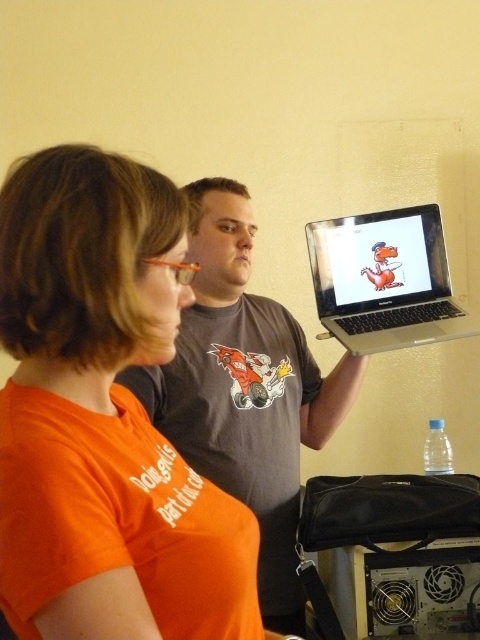
Can you confirm if orange matte shirt at upper left is positioned to the right of gray matte shirt at center?

No, orange matte shirt at upper left is not to the right of gray matte shirt at center.

Based on the photo, does orange matte shirt at upper left appear on the left side of gray matte shirt at center?

Indeed, orange matte shirt at upper left is positioned on the left side of gray matte shirt at center.

Who is more distant from viewer, (78,289) or (279,310)?

The point (279,310) is more distant.

Identify the location of orange matte shirt at upper left. (99, 404).

Who is higher up, orange matte shirt at upper left or silver metallic laptop at upper right?

Positioned higher is silver metallic laptop at upper right.

Locate an element on the screen. This screenshot has width=480, height=640. orange matte shirt at upper left is located at coordinates (99, 404).

Does gray matte shirt at center have a larger size compared to silver metallic laptop at upper right?

Indeed, gray matte shirt at center has a larger size compared to silver metallic laptop at upper right.

This screenshot has height=640, width=480. Find the location of `gray matte shirt at center`. gray matte shirt at center is located at coordinates (244, 390).

Image resolution: width=480 pixels, height=640 pixels. In order to click on gray matte shirt at center in this screenshot , I will do `click(244, 390)`.